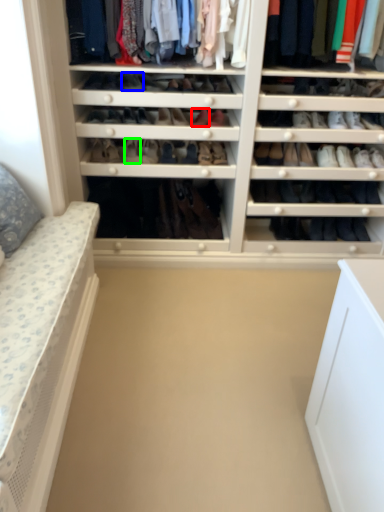
Question: Which object is positioned farthest from shoe (highlighted by a red box)? Select from shoe (highlighted by a blue box) and shoe (highlighted by a green box).

Choices:
 (A) shoe
 (B) shoe

Answer: (B)